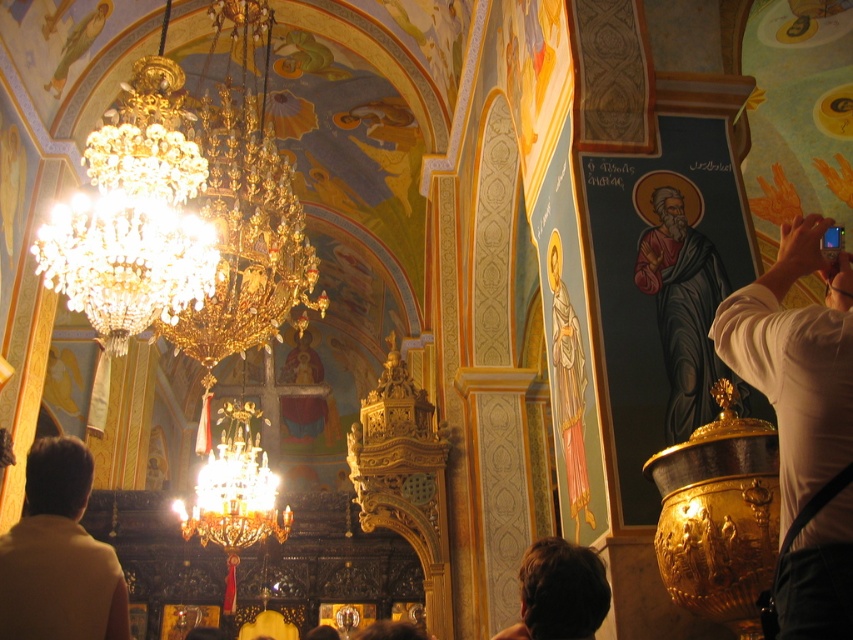
Does light brown leather jacket at lower left have a smaller size compared to matte black robe at right?

Correct, light brown leather jacket at lower left occupies less space than matte black robe at right.

Does point (114, 636) come behind point (703, 273)?

No, it is not.

Find the location of `light brown leather jacket at lower left`. light brown leather jacket at lower left is located at coordinates (59, 556).

Locate an element on the screen. The height and width of the screenshot is (640, 853). light brown leather jacket at lower left is located at coordinates (59, 556).

Is white shirt at right thinner than brown hair at lower center?

No.

Is point (828, 412) positioned before point (527, 618)?

Yes, it is.

The height and width of the screenshot is (640, 853). Identify the location of white shirt at right. (802, 420).

Can you confirm if light brown leather jacket at lower left is positioned above brown hair at lower center?

Yes.

Who is positioned more to the right, light brown leather jacket at lower left or brown hair at lower center?

brown hair at lower center

Does point (84, 449) come closer to viewer compared to point (535, 627)?

No, (84, 449) is further to viewer.

Where is `light brown leather jacket at lower left`? light brown leather jacket at lower left is located at coordinates (59, 556).